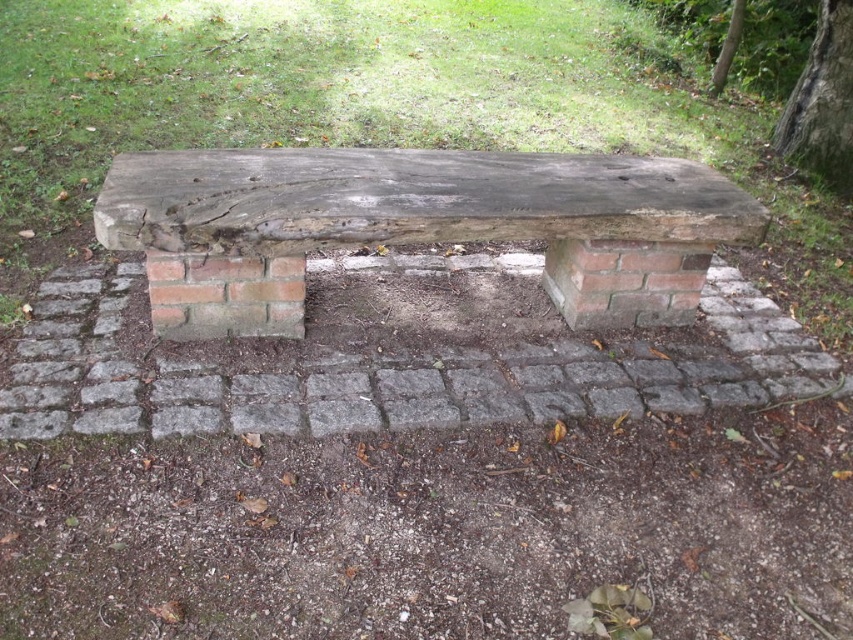
You are standing on the cobblestone path and see the green rough bark at upper right and the green leafy tree at upper right. Which object is positioned lower in the image?

The green rough bark at upper right is located below the green leafy tree at upper right, so it is positioned lower in the image.

From the picture: You are planning to have a picnic and need shade. You see the weathered wood bench at center and the green leafy tree at upper right. Which object provides shade for the bench?

The green leafy tree at upper right provides shade for the weathered wood bench at center because the bench is positioned under the tree.